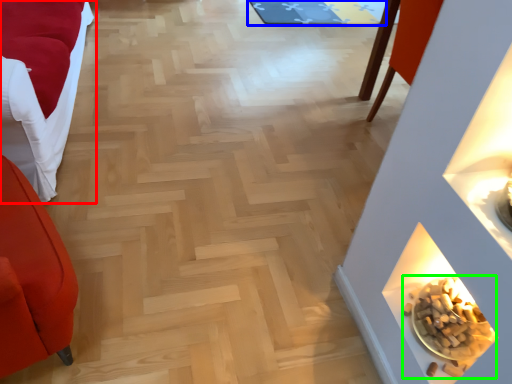
Question: Considering the real-world distances, which object is farthest from furniture (highlighted by a red box)? mat (highlighted by a blue box) or food (highlighted by a green box)?

Choices:
 (A) mat
 (B) food

Answer: (A)